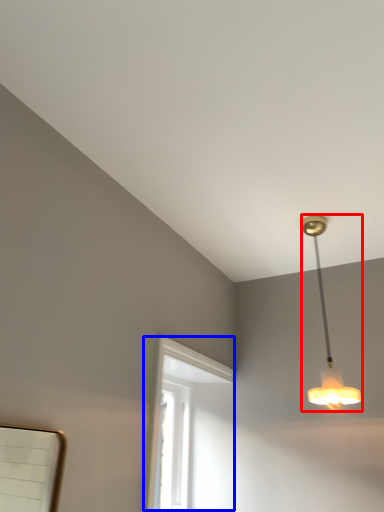
Question: Which object appears farthest to the camera in this image, lamp (highlighted by a red box) or window (highlighted by a blue box)?

Choices:
 (A) lamp
 (B) window

Answer: (A)